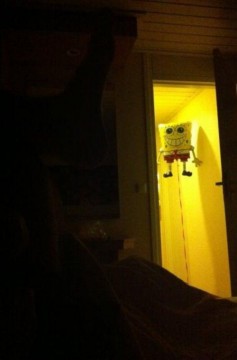
Find the location of a particular element. shadow on wall is located at coordinates (207, 157).